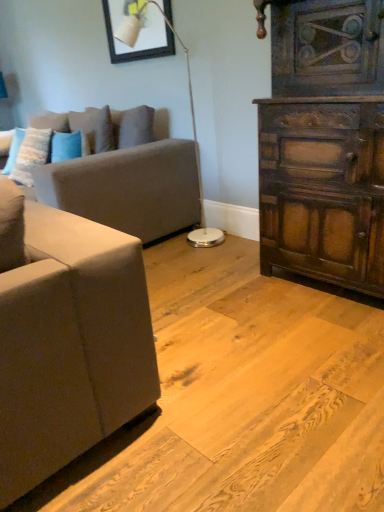
What is the approximate height of dark brown wood chest of drawers at right?

dark brown wood chest of drawers at right is 4.56 feet tall.

Describe the element at coordinates (125, 177) in the screenshot. I see `matte gray couch at left` at that location.

In order to face fluffy white pillow at left, placed as the 1th pillow when sorted from left to right, should I rotate leftwards or rightwards?

Turn left approximately 21.376 degrees to face it.

The height and width of the screenshot is (512, 384). What are the coordinates of `dark brown wood chest of drawers at right` in the screenshot? It's located at pyautogui.click(x=324, y=142).

Is white glossy floor lamp at center facing away from dark brown wood chest of drawers at right?

white glossy floor lamp at center does not have its back to dark brown wood chest of drawers at right.

Is white glossy floor lamp at center located outside dark brown wood chest of drawers at right?

Yes, white glossy floor lamp at center is outside of dark brown wood chest of drawers at right.

Find the location of a particular element. Image resolution: width=384 pixels, height=512 pixels. lamp that is on the left side of dark brown wood chest of drawers at right is located at coordinates (191, 118).

Looking at this image, can you confirm if white glossy floor lamp at center is shorter than dark brown wood chest of drawers at right?

In fact, white glossy floor lamp at center may be taller than dark brown wood chest of drawers at right.

Does blue plush pillow at upper left, which appears as the second pillow when viewed from the left, have a larger size compared to matte black picture frame at upper center?

Yes.

From a real-world perspective, between blue plush pillow at upper left, which appears as the second pillow when viewed from the left, and matte black picture frame at upper center, who is vertically higher?

matte black picture frame at upper center.

Which is in front, point (92, 119) or point (155, 18)?

The point (155, 18) is closer to the camera.

Is blue plush pillow at upper left, which appears as the second pillow when viewed from the left, not inside matte black picture frame at upper center?

That's correct, blue plush pillow at upper left, which appears as the second pillow when viewed from the left, is outside of matte black picture frame at upper center.

Does point (135, 166) lie behind point (296, 1)?

That is True.

Which object is thinner, matte gray couch at left or dark brown wood chest of drawers at right?

dark brown wood chest of drawers at right is thinner.

Which is more to the left, matte gray couch at left or dark brown wood chest of drawers at right?

From the viewer's perspective, matte gray couch at left appears more on the left side.

Does matte black picture frame at upper center have a lesser height compared to fluffy white pillow at left, placed as the 1th pillow when sorted from left to right?

No, matte black picture frame at upper center is not shorter than fluffy white pillow at left, placed as the 1th pillow when sorted from left to right.

From a real-world perspective, which is physically below, matte black picture frame at upper center or fluffy white pillow at left, which is the second pillow from right to left?

fluffy white pillow at left, which is the second pillow from right to left, from a real-world perspective.

Considering the sizes of matte black picture frame at upper center and fluffy white pillow at left, placed as the 1th pillow when sorted from left to right, in the image, is matte black picture frame at upper center wider or thinner than fluffy white pillow at left, placed as the 1th pillow when sorted from left to right,?

Clearly, matte black picture frame at upper center has less width compared to fluffy white pillow at left, placed as the 1th pillow when sorted from left to right.

From the picture: Is the depth of matte black picture frame at upper center less than that of fluffy white pillow at left, placed as the 1th pillow when sorted from left to right?

Yes, the depth of matte black picture frame at upper center is less than that of fluffy white pillow at left, placed as the 1th pillow when sorted from left to right.

Measure the distance between matte black picture frame at upper center and matte gray couch at left.

They are 28.29 inches apart.

From a real-world perspective, is matte black picture frame at upper center positioned above or below matte gray couch at left?

In terms of real-world spatial position, matte black picture frame at upper center is above matte gray couch at left.

Which is in front, point (110, 24) or point (75, 187)?

Positioned in front is point (75, 187).

Between matte black picture frame at upper center and matte gray couch at left, which one has larger size?

matte gray couch at left is bigger.

Measure the distance from dark brown wood chest of drawers at right to matte black picture frame at upper center.

dark brown wood chest of drawers at right and matte black picture frame at upper center are 1.28 meters apart.

Looking at this image, does dark brown wood chest of drawers at right appear on the left side of matte black picture frame at upper center?

In fact, dark brown wood chest of drawers at right is to the right of matte black picture frame at upper center.

Considering the sizes of objects dark brown wood chest of drawers at right and matte black picture frame at upper center in the image provided, who is smaller, dark brown wood chest of drawers at right or matte black picture frame at upper center?

matte black picture frame at upper center is smaller.

Which is in front, point (334, 32) or point (174, 42)?

The point (334, 32) is closer.

Image resolution: width=384 pixels, height=512 pixels. I want to click on picture frame that appears above the matte gray couch at left (from the image's perspective), so click(x=141, y=32).

Is matte gray couch at left not within matte black picture frame at upper center?

Absolutely, matte gray couch at left is external to matte black picture frame at upper center.

Is matte gray couch at left aimed at matte black picture frame at upper center?

No, matte gray couch at left is not facing towards matte black picture frame at upper center.

You are a GUI agent. You are given a task and a screenshot of the screen. Output one action in this format:
    pyautogui.click(x=<x>, y=<y>)
    Task: Click on the chest of drawers below the white glossy floor lamp at center (from a real-world perspective)
    The width and height of the screenshot is (384, 512).
    Given the screenshot: What is the action you would take?
    pyautogui.click(x=324, y=142)

Where is `picture frame that is above the blue plush pillow at upper left, arranged as the 1th pillow when viewed from the right (from the image's perspective)`? picture frame that is above the blue plush pillow at upper left, arranged as the 1th pillow when viewed from the right (from the image's perspective) is located at coordinates (141, 32).

Looking at the image, which one is located closer to matte gray couch at left, fluffy white pillow at left, placed as the 1th pillow when sorted from left to right, or matte black picture frame at upper center?

Among the two, fluffy white pillow at left, placed as the 1th pillow when sorted from left to right, is located nearer to matte gray couch at left.

When comparing their distances from fluffy white pillow at left, placed as the 1th pillow when sorted from left to right, does matte gray couch at left or dark brown wood chest of drawers at right seem closer?

matte gray couch at left lies closer to fluffy white pillow at left, placed as the 1th pillow when sorted from left to right, than the other object.

From the image, which object appears to be nearer to blue plush pillow at upper left, arranged as the 1th pillow when viewed from the right, matte black picture frame at upper center or matte gray couch at left?

The object closer to blue plush pillow at upper left, arranged as the 1th pillow when viewed from the right, is matte gray couch at left.

When comparing their distances from matte black picture frame at upper center, does matte gray couch at left or blue plush pillow at upper left, which appears as the second pillow when viewed from the left, seem further?

matte gray couch at left.

Looking at the image, which one is located further to white glossy floor lamp at center, blue plush pillow at upper left, arranged as the 1th pillow when viewed from the right, or dark brown wood chest of drawers at right?

Among the two, dark brown wood chest of drawers at right is located further to white glossy floor lamp at center.

Considering their positions, is dark brown wood chest of drawers at right positioned further to blue plush pillow at upper left, arranged as the 1th pillow when viewed from the right, than matte gray couch at left?

dark brown wood chest of drawers at right lies further to blue plush pillow at upper left, arranged as the 1th pillow when viewed from the right, than the other object.

When comparing their distances from blue plush pillow at upper left, which appears as the second pillow when viewed from the left, does white glossy floor lamp at center or matte gray couch at left seem closer?

Among the two, matte gray couch at left is located nearer to blue plush pillow at upper left, which appears as the second pillow when viewed from the left.

Consider the image. Considering their positions, is matte gray couch at left positioned further to dark brown wood chest of drawers at right than blue plush pillow at upper left, arranged as the 1th pillow when viewed from the right?

blue plush pillow at upper left, arranged as the 1th pillow when viewed from the right, is further to dark brown wood chest of drawers at right.

Image resolution: width=384 pixels, height=512 pixels. Find the location of `studio couch located between fluffy white pillow at left, which is the second pillow from right to left, and dark brown wood chest of drawers at right in the left-right direction`. studio couch located between fluffy white pillow at left, which is the second pillow from right to left, and dark brown wood chest of drawers at right in the left-right direction is located at coordinates (x=125, y=177).

Where is `lamp between matte gray couch at left and dark brown wood chest of drawers at right`? This screenshot has width=384, height=512. lamp between matte gray couch at left and dark brown wood chest of drawers at right is located at coordinates (191, 118).

Identify the location of lamp between fluffy white pillow at left, which is the second pillow from right to left, and dark brown wood chest of drawers at right, in the horizontal direction. pyautogui.click(x=191, y=118).

At what (x,y) coordinates should I click in order to perform the action: click on picture frame between fluffy white pillow at left, placed as the 1th pillow when sorted from left to right, and white glossy floor lamp at center from left to right. Please return your answer as a coordinate pair (x, y). The image size is (384, 512). Looking at the image, I should click on (141, 32).